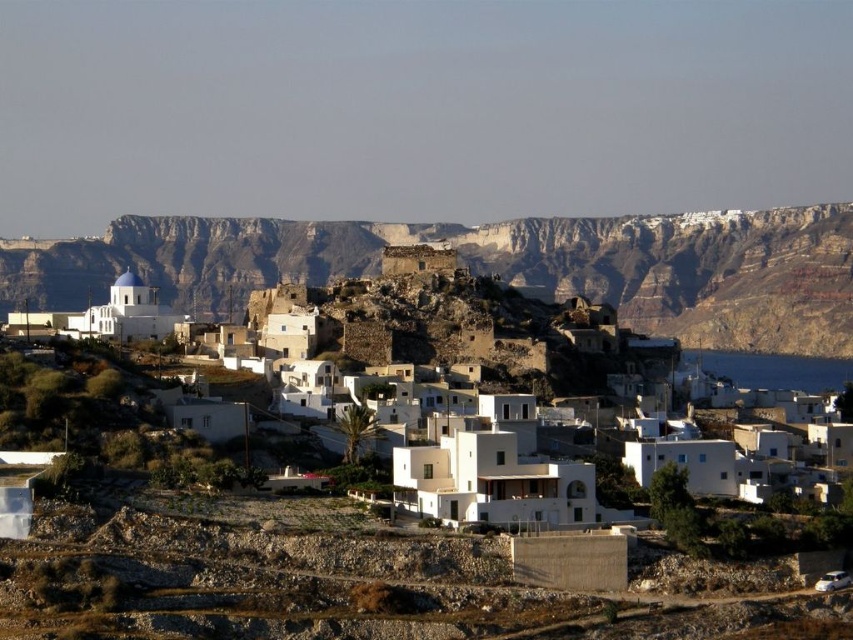
Question: Which point is farther from the camera taking this photo?

Choices:
 (A) (828, 381)
 (B) (643, 275)

Answer: (B)

Question: Does rugged stone cliff at center appear over white stone buildings at center?

Choices:
 (A) yes
 (B) no

Answer: (A)

Question: Is white stone buildings at center thinner than blue water at lower right?

Choices:
 (A) no
 (B) yes

Answer: (A)

Question: Does rugged stone cliff at center appear over white stone buildings at center?

Choices:
 (A) yes
 (B) no

Answer: (A)

Question: Which of these objects is positioned closest to the blue water at lower right?

Choices:
 (A) rugged stone cliff at center
 (B) white stone buildings at center

Answer: (A)

Question: Which of these objects is positioned closest to the blue water at lower right?

Choices:
 (A) rugged stone cliff at center
 (B) white stone buildings at center

Answer: (A)